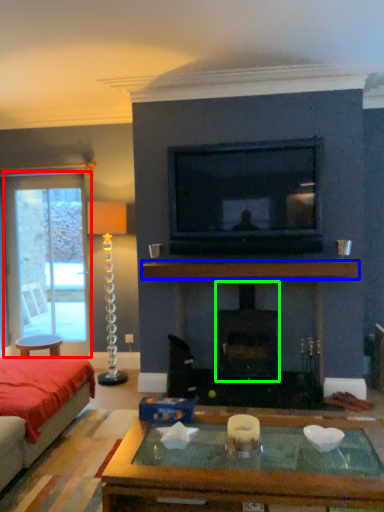
Question: Which object is positioned closest to screen door (highlighted by a red box)? Select from mantle (highlighted by a blue box) and fireplace (highlighted by a green box).

Choices:
 (A) mantle
 (B) fireplace

Answer: (A)